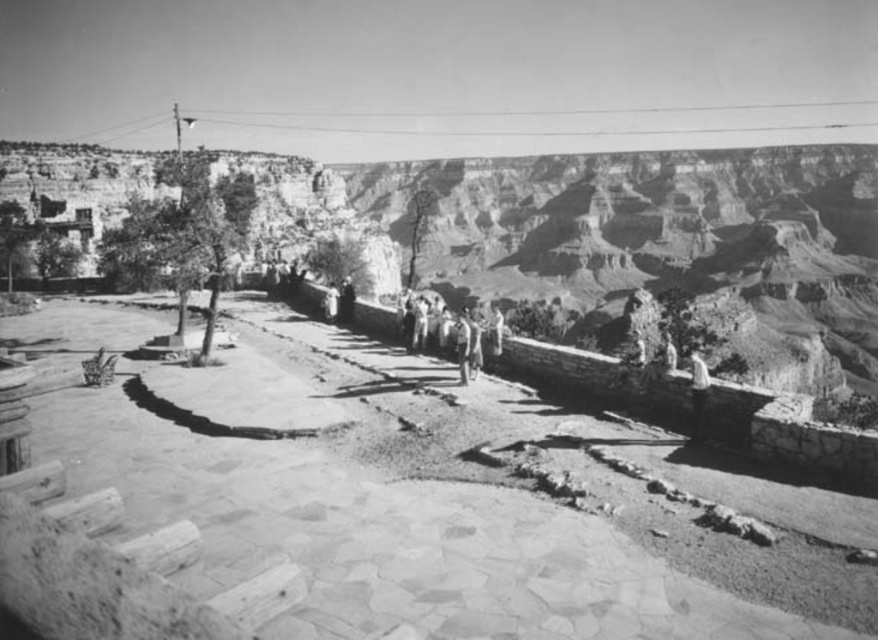
You are standing on the paved pathway at the Grand Canyon overlook and see the light gray fabric shirt at upper right and the light beige stone person at center. Which person is closer to you?

The light gray fabric shirt at upper right is closer to you because it is in front of the light beige stone person at center.

You are a photographer planning to take a group photo of the light beige stone person at center and the smooth skin person at center. You want to ensure both subjects are fully visible in the frame. Which subject should you position closer to the camera to avoid cropping either of them?

You should position the smooth skin person at center closer to the camera because the light beige stone person at center is wider. Placing the narrower subject closer will help fit both into the frame without cropping.

You are standing at the overlook and want to take a photo of the two points marked in the image. Which point, point (x=696, y=428) or point (x=664, y=339), is closer to you?

Point (x=696, y=428) is closer to you because it is in front of point (x=664, y=339).